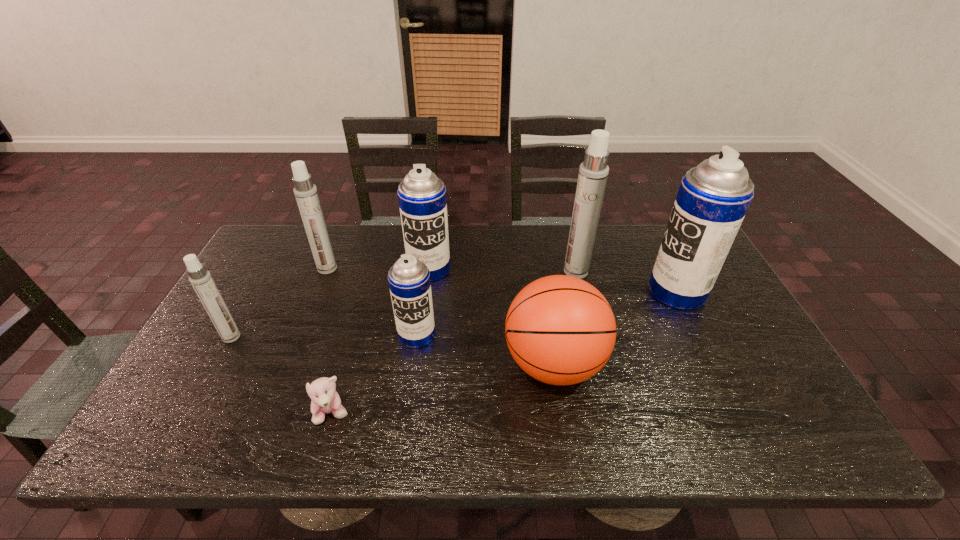
Identify the location of vacant space at the near left corner of the desktop. The height and width of the screenshot is (540, 960). (220, 428).

Identify the location of vacant area that lies between the rightmost blue aerosol can and the second white aerosol can from right to left. This screenshot has width=960, height=540. (502, 280).

Image resolution: width=960 pixels, height=540 pixels. What are the coordinates of `unoccupied area between the basketball and the leftmost object` in the screenshot? It's located at (393, 350).

You are a GUI agent. You are given a task and a screenshot of the screen. Output one action in this format:
    pyautogui.click(x=<x>, y=<y>)
    Task: Click on the free spot between the second object from left to right and the fifth aerosol can from left to right
    This screenshot has width=960, height=540.
    Given the screenshot: What is the action you would take?
    pyautogui.click(x=451, y=270)

Where is `unoccupied area between the leftmost object and the second aerosol can from left to right`? The width and height of the screenshot is (960, 540). unoccupied area between the leftmost object and the second aerosol can from left to right is located at coordinates (279, 302).

Locate an element on the screen. The height and width of the screenshot is (540, 960). vacant space in between the nearest white aerosol can and the basketball is located at coordinates (393, 350).

You are a GUI agent. You are given a task and a screenshot of the screen. Output one action in this format:
    pyautogui.click(x=<x>, y=<y>)
    Task: Click on the vacant space in between the orange basketball and the nearest blue aerosol can
    The height and width of the screenshot is (540, 960).
    Given the screenshot: What is the action you would take?
    pyautogui.click(x=485, y=349)

Locate an element on the screen. the third closest object relative to the rightmost blue aerosol can is located at coordinates (422, 199).

Locate which object is the sixth closest to the basketball. Please provide its 2D coordinates. Your answer should be formatted as a tuple, i.e. [(x, y)], where the tuple contains the x and y coordinates of a point satisfying the conditions above.

[(306, 194)]

Identify which aerosol can is located as the second nearest to the biggest white aerosol can. Please provide its 2D coordinates. Your answer should be formatted as a tuple, i.e. [(x, y)], where the tuple contains the x and y coordinates of a point satisfying the conditions above.

[(422, 199)]